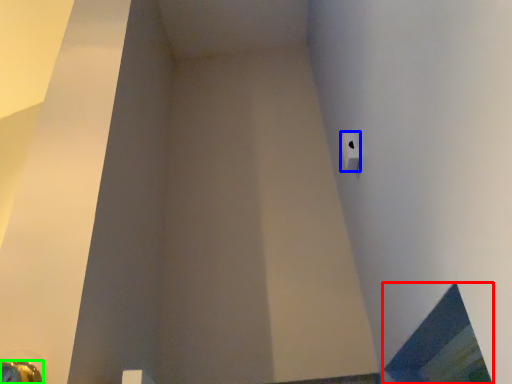
Question: Considering the real-world distances, which object is closest to window (highlighted by a red box)? toilet paper (highlighted by a blue box) or door handle (highlighted by a green box).

Choices:
 (A) toilet paper
 (B) door handle

Answer: (A)